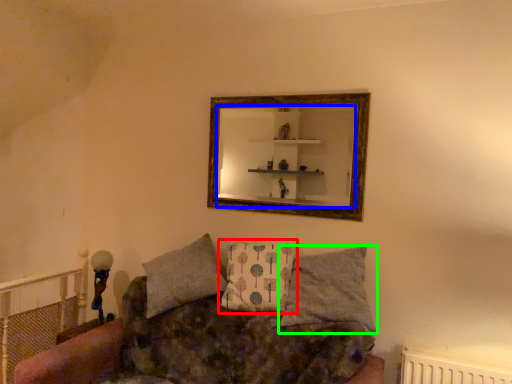
Question: Which object is positioned closest to pillow (highlighted by a red box)? Select from mirror (highlighted by a blue box) and pillow (highlighted by a green box).

Choices:
 (A) mirror
 (B) pillow

Answer: (B)